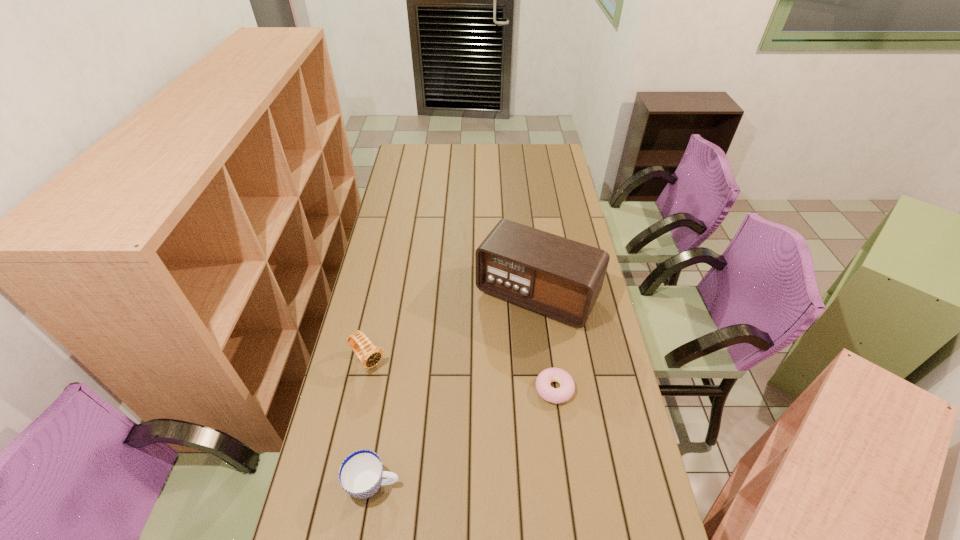
Where is `free space located 0.170m on the face of the watch`? Image resolution: width=960 pixels, height=540 pixels. free space located 0.170m on the face of the watch is located at coordinates (411, 407).

Image resolution: width=960 pixels, height=540 pixels. Find the location of `vacant space located on the front-facing side of the tallest object`. vacant space located on the front-facing side of the tallest object is located at coordinates (490, 363).

Identify the location of vacant space located on the front-facing side of the tallest object. (454, 421).

What are the coordinates of `free location located on the front-facing side of the tallest object` in the screenshot? It's located at (480, 379).

The height and width of the screenshot is (540, 960). I want to click on object positioned at the near edge, so click(361, 474).

Where is `cup positioned at the left edge`? The image size is (960, 540). cup positioned at the left edge is located at coordinates (361, 474).

You are a GUI agent. You are given a task and a screenshot of the screen. Output one action in this format:
    pyautogui.click(x=<x>, y=<y>)
    Task: Click on the watch that is at the left edge
    
    Given the screenshot: What is the action you would take?
    pyautogui.click(x=370, y=355)

Find the location of a particular element. doughnut at the right edge is located at coordinates (567, 386).

At what (x,y) coordinates should I click in order to perform the action: click on radio receiver located at the right edge. Please return your answer as a coordinate pair (x, y). The height and width of the screenshot is (540, 960). Looking at the image, I should click on (560, 278).

Locate an element on the screen. This screenshot has width=960, height=540. object that is at the near left corner is located at coordinates (361, 474).